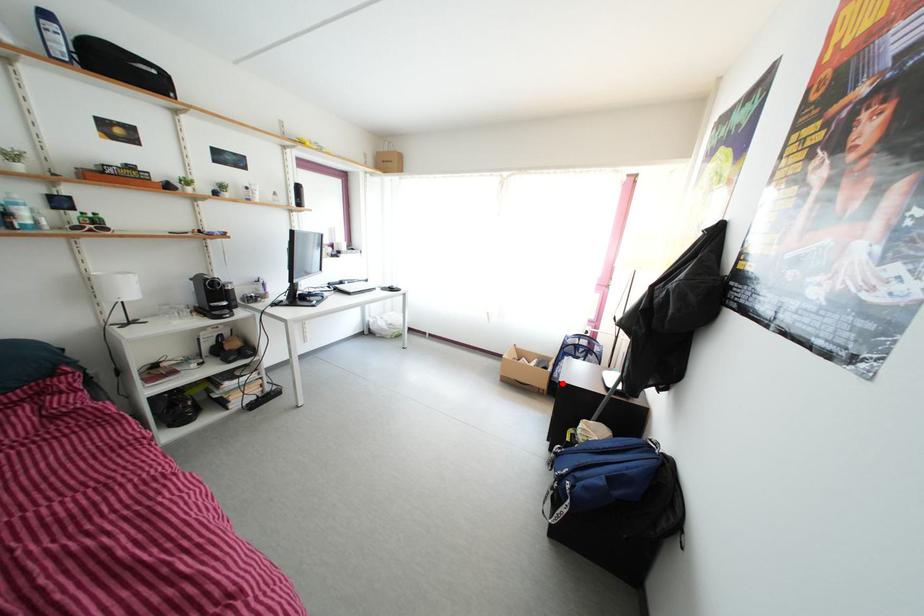
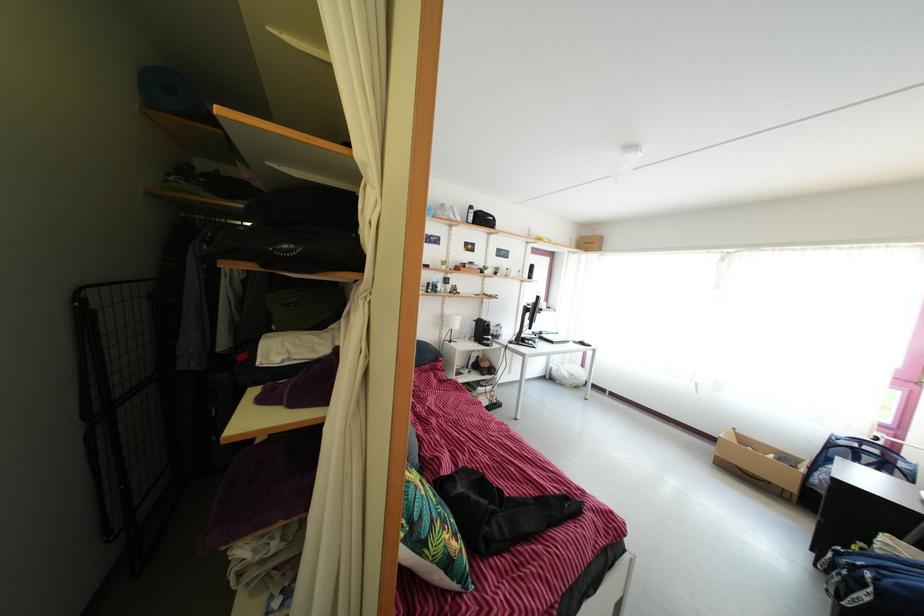
Where in the second image is the point corresponding to the highlighted location from the first image?

(821, 488)